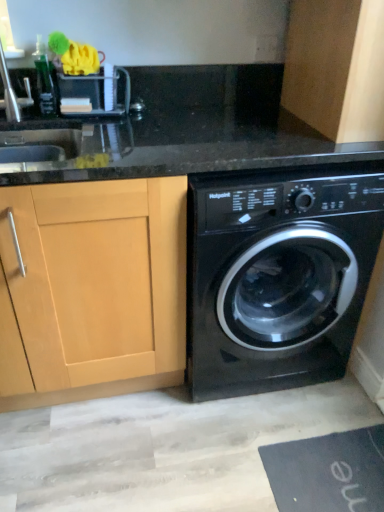
Question: Is black rubber bath mat at lower right situated inside black glossy washing machine at lower right or outside?

Choices:
 (A) outside
 (B) inside

Answer: (A)

Question: Considering the positions of black rubber bath mat at lower right and black glossy washing machine at lower right in the image, is black rubber bath mat at lower right wider or thinner than black glossy washing machine at lower right?

Choices:
 (A) wide
 (B) thin

Answer: (B)

Question: Estimate the real-world distances between objects in this image. Which object is farther from the light wood cabinet at left, the second cabinetry in the right-to-left sequence?

Choices:
 (A) wooden cabinet at upper right, positioned as the first cabinetry in right-to-left order
 (B) black rubber bath mat at lower right
 (C) black glossy washing machine at lower right

Answer: (A)

Question: Based on their relative distances, which object is farther from the wooden cabinet at upper right, marked as the 2th cabinetry in a bottom-to-top arrangement?

Choices:
 (A) light wood cabinet at left, the second cabinetry in the right-to-left sequence
 (B) black glossy washing machine at lower right
 (C) black rubber bath mat at lower right

Answer: (C)